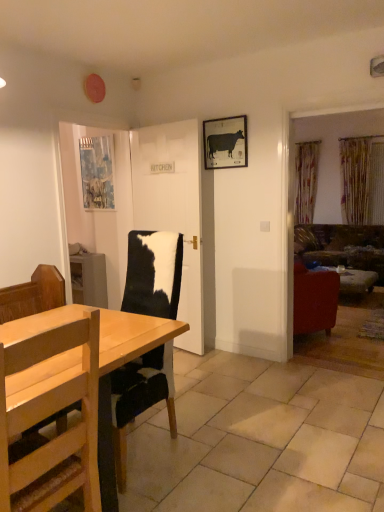
In order to face gold textured curtain at right, should I rotate leftwards or rightwards?

To align with it, rotate right about 21.011°.

What do you see at coordinates (225, 142) in the screenshot? This screenshot has height=512, width=384. I see `matte black cow at upper center, arranged as the 2th picture frame when viewed from the left` at bounding box center [225, 142].

I want to click on blue textured fabric at upper left, which appears as the second picture frame when viewed from the front, so click(97, 172).

Find the location of `curtain behind the light wood chair at lower left`. curtain behind the light wood chair at lower left is located at coordinates (361, 179).

Is light wood chair at lower left further to camera compared to gold textured curtain at right?

No, light wood chair at lower left is in front of gold textured curtain at right.

Looking at their sizes, would you say light wood chair at lower left is wider or thinner than gold textured curtain at right?

Considering their sizes, light wood chair at lower left looks broader than gold textured curtain at right.

From a real-world perspective, who is located lower, light wood chair at lower left or gold textured curtain at right?

light wood chair at lower left.

Is the position of matte black cow at upper center, marked as the 1th picture frame in a right-to-left arrangement, more distant than that of wooden table at lower right?

That is False.

Which is more to the left, matte black cow at upper center, acting as the first picture frame starting from the front, or wooden table at lower right?

Positioned to the left is matte black cow at upper center, acting as the first picture frame starting from the front.

How many degrees apart are the facing directions of matte black cow at upper center, marked as the 1th picture frame in a right-to-left arrangement, and wooden table at lower right?

The angular difference between matte black cow at upper center, marked as the 1th picture frame in a right-to-left arrangement, and wooden table at lower right is 88.5 degrees.

From a real-world perspective, starting from the wooden table at lower right, which picture frame is the 2nd one vertically above it? Please provide its 2D coordinates.

[(225, 142)]

How different are the orientations of wooden table at lower right and gold textured curtain at right in degrees?

There is a 89.3-degree angle between the facing directions of wooden table at lower right and gold textured curtain at right.

Does wooden table at lower right have a smaller size compared to gold textured curtain at right?

Correct, wooden table at lower right occupies less space than gold textured curtain at right.

Which is more to the right, wooden table at lower right or gold textured curtain at right?

Positioned to the right is gold textured curtain at right.

Considering the positions of objects wooden table at lower right and gold textured curtain at right in the image provided, who is behind, wooden table at lower right or gold textured curtain at right?

gold textured curtain at right is further away from the camera.

From the image's perspective, is wooden table at lower right beneath light wood chair at lower left?

No, from the image's perspective, wooden table at lower right is not beneath light wood chair at lower left.

Is wooden table at lower right touching light wood chair at lower left?

No, wooden table at lower right is not next to light wood chair at lower left.

Can you confirm if wooden table at lower right is shorter than light wood chair at lower left?

Indeed, wooden table at lower right has a lesser height compared to light wood chair at lower left.

Locate an element on the screen. chair above the wooden table at lower right (from a real-world perspective) is located at coordinates (47, 415).

Would you consider wooden table at lower right to be distant from velvet green sofa at right?

No, there isn't a large distance between wooden table at lower right and velvet green sofa at right.

Identify the location of table in front of the velvet green sofa at right. The image size is (384, 512). (352, 279).

Is wooden table at lower right shorter than velvet green sofa at right?

Indeed, wooden table at lower right has a lesser height compared to velvet green sofa at right.

Is wooden table at lower right facing away from velvet green sofa at right?

That's not correct — wooden table at lower right is not looking away from velvet green sofa at right.

From the image's perspective, is velvet green sofa at right on top of matte black cow at upper center, marked as the 1th picture frame in a right-to-left arrangement?

Actually, velvet green sofa at right appears below matte black cow at upper center, marked as the 1th picture frame in a right-to-left arrangement, in the image.

The height and width of the screenshot is (512, 384). In order to click on the 1st picture frame to the left when counting from the velvet green sofa at right in this screenshot , I will do `click(225, 142)`.

From a real-world perspective, relative to matte black cow at upper center, arranged as the 2th picture frame when viewed from the back, is velvet green sofa at right vertically above or below?

From a real-world perspective, velvet green sofa at right is physically below matte black cow at upper center, arranged as the 2th picture frame when viewed from the back.

Between velvet green sofa at right and matte black cow at upper center, acting as the first picture frame starting from the front, which one is positioned in front?

matte black cow at upper center, acting as the first picture frame starting from the front, is more forward.

From the image's perspective, which is below, velvet green sofa at right or white glossy door at center?

velvet green sofa at right, from the image's perspective.

I want to click on door located above the velvet green sofa at right (from the image's perspective), so (173, 208).

Can you tell me how much velvet green sofa at right and white glossy door at center differ in facing direction?

The facing directions of velvet green sofa at right and white glossy door at center are 9.92 degrees apart.

Consider the image. Considering the relative sizes of velvet green sofa at right and white glossy door at center in the image provided, is velvet green sofa at right thinner than white glossy door at center?

Incorrect, the width of velvet green sofa at right is not less than that of white glossy door at center.

The width and height of the screenshot is (384, 512). Identify the location of chair that is in front of the gold textured curtain at right. (47, 415).

Identify the location of the 2nd picture frame above when counting from the wooden table at lower right (from the image's perspective). Image resolution: width=384 pixels, height=512 pixels. (225, 142).

Considering their positions, is light wood chair at lower left positioned further to velvet green sofa at right than gold textured curtain at right?

light wood chair at lower left is further to velvet green sofa at right.

Consider the image. Which object lies nearer to the anchor point blue textured fabric at upper left, the first picture frame when ordered from left to right, wooden table at lower right or white glossy door at center?

Among the two, white glossy door at center is located nearer to blue textured fabric at upper left, the first picture frame when ordered from left to right.

Considering their positions, is matte black cow at upper center, arranged as the 2th picture frame when viewed from the left, positioned closer to light wood chair at lower left than white glossy door at center?

white glossy door at center lies closer to light wood chair at lower left than the other object.

Estimate the real-world distances between objects in this image. Which object is closer to wooden table at lower right, gold textured curtain at right or light wood chair at lower left?

gold textured curtain at right.

Looking at the image, which one is located further to matte black cow at upper center, arranged as the 2th picture frame when viewed from the back, wooden table at lower right or light wood chair at lower left?

wooden table at lower right.

From the image, which object appears to be nearer to white glossy door at center, wooden table at lower right or gold textured curtain at right?

wooden table at lower right is positioned closer to the anchor white glossy door at center.

From the image, which object appears to be nearer to gold textured curtain at right, white glossy door at center or matte black cow at upper center, arranged as the 2th picture frame when viewed from the back?

The object closer to gold textured curtain at right is matte black cow at upper center, arranged as the 2th picture frame when viewed from the back.

Which object lies nearer to the anchor point blue textured fabric at upper left, which is counted as the second picture frame, starting from the right, white glossy door at center or velvet green sofa at right?

Based on the image, white glossy door at center appears to be nearer to blue textured fabric at upper left, which is counted as the second picture frame, starting from the right.

Locate an element on the screen. The image size is (384, 512). table between blue textured fabric at upper left, which is counted as the second picture frame, starting from the right, and gold textured curtain at right is located at coordinates (352, 279).

Locate an element on the screen. studio couch located between light wood chair at lower left and gold textured curtain at right in the depth direction is located at coordinates (341, 246).

At what (x,y) coordinates should I click in order to perform the action: click on studio couch between white glossy door at center and gold textured curtain at right in the front-back direction. Please return your answer as a coordinate pair (x, y). Image resolution: width=384 pixels, height=512 pixels. Looking at the image, I should click on (341, 246).

Find the location of `table between blue textured fabric at upper left, which is counted as the second picture frame, starting from the right, and velvet green sofa at right, in the horizontal direction`. table between blue textured fabric at upper left, which is counted as the second picture frame, starting from the right, and velvet green sofa at right, in the horizontal direction is located at coordinates (352, 279).